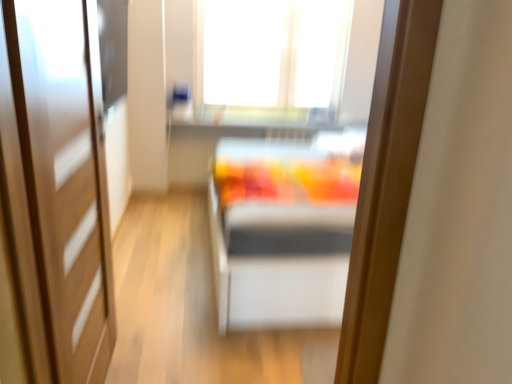
Question: Should I look upward or downward to see transparent glass window at upper center?

Choices:
 (A) up
 (B) down

Answer: (A)

Question: Does wooden door at left have a lesser height compared to transparent glass window at upper center?

Choices:
 (A) yes
 (B) no

Answer: (B)

Question: Can you confirm if wooden door at left is positioned to the right of transparent glass window at upper center?

Choices:
 (A) no
 (B) yes

Answer: (A)

Question: From a real-world perspective, is wooden door at left positioned over transparent glass window at upper center based on gravity?

Choices:
 (A) no
 (B) yes

Answer: (A)

Question: Can you confirm if wooden door at left is positioned to the left of transparent glass window at upper center?

Choices:
 (A) no
 (B) yes

Answer: (B)

Question: Are wooden door at left and transparent glass window at upper center located far from each other?

Choices:
 (A) yes
 (B) no

Answer: (A)

Question: Does wooden door at left have a greater width compared to transparent glass window at upper center?

Choices:
 (A) no
 (B) yes

Answer: (A)

Question: Considering the relative sizes of transparent glass window at upper center and wooden door at left in the image provided, is transparent glass window at upper center bigger than wooden door at left?

Choices:
 (A) no
 (B) yes

Answer: (B)

Question: Is transparent glass window at upper center not close to wooden door at left?

Choices:
 (A) no
 (B) yes

Answer: (B)

Question: Does transparent glass window at upper center have a lesser height compared to wooden door at left?

Choices:
 (A) no
 (B) yes

Answer: (B)

Question: Can you confirm if transparent glass window at upper center is thinner than wooden door at left?

Choices:
 (A) yes
 (B) no

Answer: (B)

Question: Is transparent glass window at upper center at the left side of wooden door at left?

Choices:
 (A) yes
 (B) no

Answer: (B)

Question: Could you tell me if transparent glass window at upper center is turned towards wooden door at left?

Choices:
 (A) no
 (B) yes

Answer: (B)

Question: Looking at their shapes, would you say wooden door at left is wider or thinner than transparent glass window at upper center?

Choices:
 (A) wide
 (B) thin

Answer: (B)